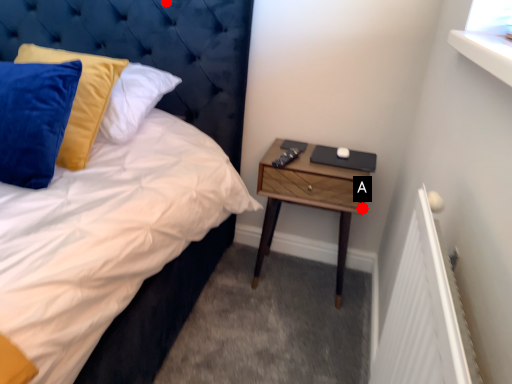
Question: Two points are circled on the image, labeled by A and B beside each circle. Which point is further to the camera?

Choices:
 (A) A is further
 (B) B is further

Answer: (A)